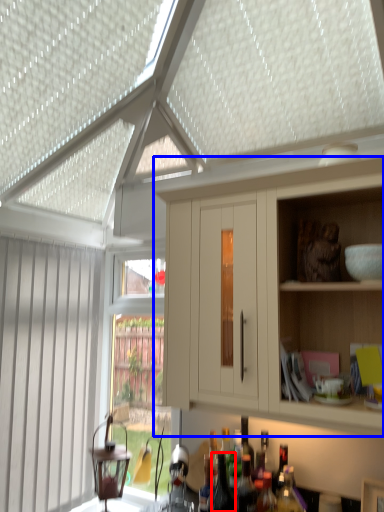
Question: Which point is closer to the camera, bottle (highlighted by a red box) or cabinetry (highlighted by a blue box)?

Choices:
 (A) bottle
 (B) cabinetry

Answer: (B)